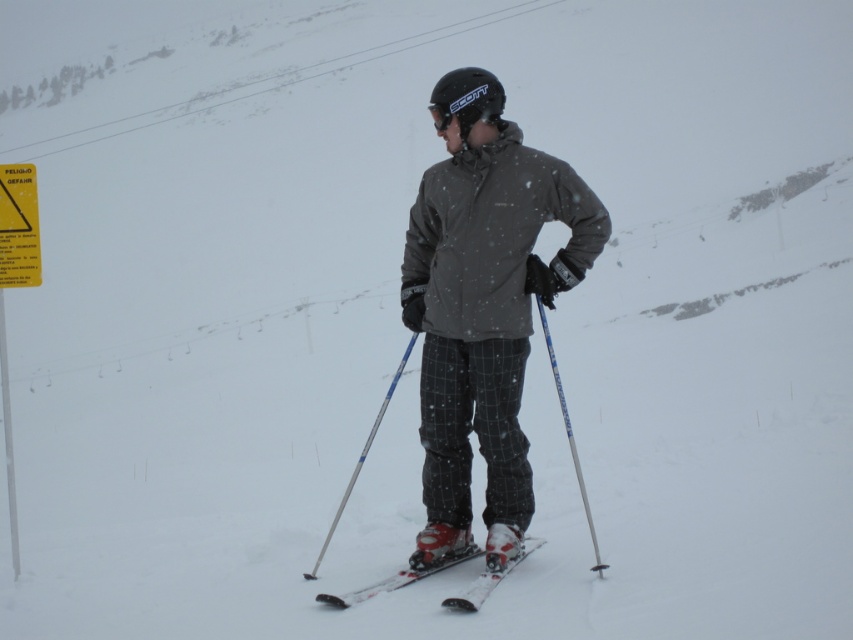
Question: Which object is positioned closest to the blue metallic ski pole at center?

Choices:
 (A) white plastic ski at center
 (B) yellow paper sign at upper left
 (C) dark gray matte jacket at center

Answer: (A)

Question: Is the position of white plastic ski at center less distant than that of blue metallic ski pole at center?

Choices:
 (A) yes
 (B) no

Answer: (A)

Question: Which object is positioned farthest from the yellow paper sign at upper left?

Choices:
 (A) blue metallic ski pole at center
 (B) black matte goggles at upper center

Answer: (A)

Question: Based on their relative distances, which object is nearer to the white plastic ski at center?

Choices:
 (A) yellow paper sign at upper left
 (B) blue metallic ski pole at center
 (C) silver metallic ski pole at center

Answer: (B)

Question: Is blue metallic ski pole at center thinner than black matte goggles at upper center?

Choices:
 (A) no
 (B) yes

Answer: (A)

Question: Does white plastic ski at center lie in front of black matte goggles at upper center?

Choices:
 (A) yes
 (B) no

Answer: (A)